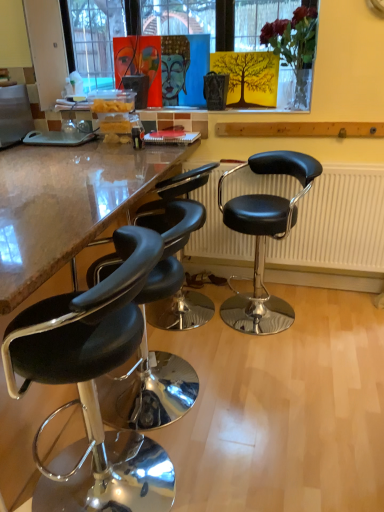
Question: Is black leather stool at left, the 4th chair positioned from the right, placed right next to black leather stool at lower left, placed as the third chair when sorted from right to left?

Choices:
 (A) yes
 (B) no

Answer: (B)

Question: Considering the relative sizes of black leather stool at left, the 4th chair positioned from the right, and black leather stool at lower left, arranged as the second chair when viewed from the left, in the image provided, is black leather stool at left, the 4th chair positioned from the right, smaller than black leather stool at lower left, arranged as the second chair when viewed from the left,?

Choices:
 (A) no
 (B) yes

Answer: (A)

Question: Does black leather stool at left, which ranks as the 1th chair in left-to-right order, lie behind black leather stool at lower left, arranged as the second chair when viewed from the left?

Choices:
 (A) no
 (B) yes

Answer: (A)

Question: Is black leather stool at left, the 4th chair positioned from the right, completely or partially outside of black leather stool at lower left, placed as the third chair when sorted from right to left?

Choices:
 (A) no
 (B) yes

Answer: (B)

Question: From the image's perspective, would you say black leather stool at left, the 4th chair positioned from the right, is shown under black leather stool at lower left, placed as the third chair when sorted from right to left?

Choices:
 (A) no
 (B) yes

Answer: (B)

Question: Is black leather stool at left, the 4th chair positioned from the right, not near black leather stool at lower left, arranged as the second chair when viewed from the left?

Choices:
 (A) no
 (B) yes

Answer: (A)

Question: Would you say black leather stool at right, placed as the 4th chair when sorted from left to right, is outside black leather radiator at center?

Choices:
 (A) no
 (B) yes

Answer: (B)

Question: From a real-world perspective, is black leather stool at right, placed as the first chair when sorted from right to left, physically above black leather radiator at center?

Choices:
 (A) no
 (B) yes

Answer: (A)

Question: From the image's perspective, does black leather stool at right, placed as the first chair when sorted from right to left, appear lower than black leather radiator at center?

Choices:
 (A) yes
 (B) no

Answer: (A)

Question: Is black leather stool at right, placed as the first chair when sorted from right to left, bigger than black leather radiator at center?

Choices:
 (A) no
 (B) yes

Answer: (B)

Question: Is black leather stool at right, placed as the 4th chair when sorted from left to right, positioned behind black leather radiator at center?

Choices:
 (A) yes
 (B) no

Answer: (B)

Question: Does black leather stool at right, placed as the first chair when sorted from right to left, appear on the left side of black leather radiator at center?

Choices:
 (A) yes
 (B) no

Answer: (A)

Question: Does black leather stool at left, the 4th chair positioned from the right, appear on the right side of black leather radiator at center?

Choices:
 (A) yes
 (B) no

Answer: (B)